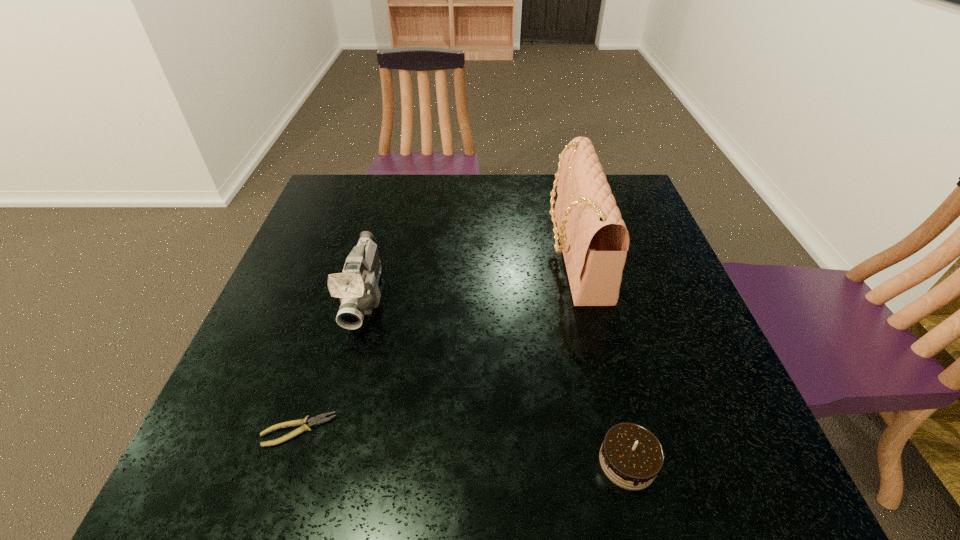
The image size is (960, 540). What are the coordinates of `object present at the far edge` in the screenshot? It's located at 594,240.

The image size is (960, 540). Find the location of `chocolate cake situated at the near edge`. chocolate cake situated at the near edge is located at coordinates (631, 456).

The image size is (960, 540). I want to click on pliers situated at the near edge, so click(x=318, y=420).

Where is `object that is at the left edge`? Image resolution: width=960 pixels, height=540 pixels. object that is at the left edge is located at coordinates (318, 420).

This screenshot has width=960, height=540. What are the coordinates of `object at the near left corner` in the screenshot? It's located at (318, 420).

In the image, there is a desktop. At what (x,y) coordinates should I click in order to perform the action: click on free region at the far edge. Please return your answer as a coordinate pair (x, y). Looking at the image, I should click on (x=381, y=178).

Image resolution: width=960 pixels, height=540 pixels. I want to click on vacant space at the left edge, so click(x=313, y=246).

Where is `vacant space at the right edge of the desktop`? vacant space at the right edge of the desktop is located at coordinates (637, 281).

The height and width of the screenshot is (540, 960). I want to click on vacant space at the far left corner of the desktop, so click(321, 206).

Image resolution: width=960 pixels, height=540 pixels. I want to click on vacant area at the far right corner, so click(x=624, y=199).